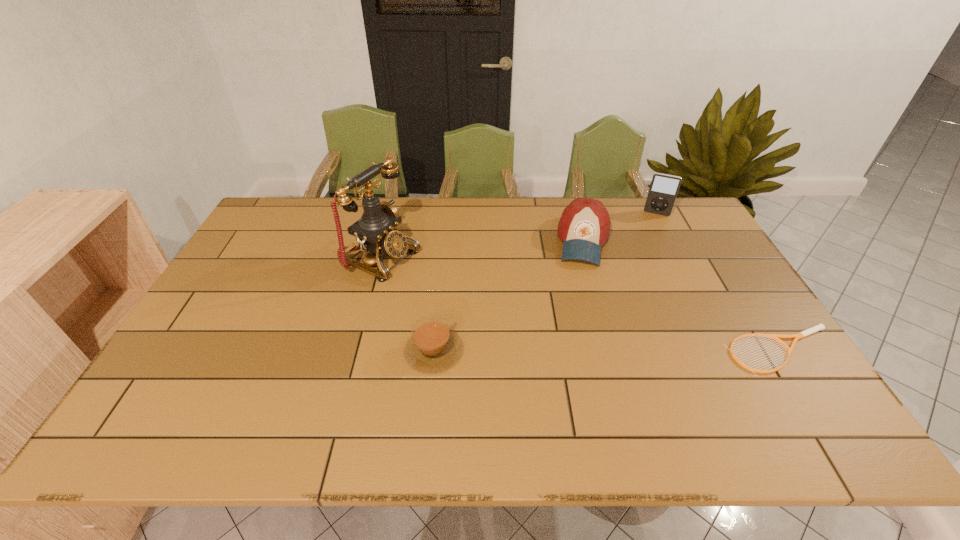
I want to click on cappuccino, so click(432, 346).

At what (x,y) coordinates should I click in order to perform the action: click on tennis racket. Please return your answer as a coordinate pair (x, y). The image size is (960, 540). Looking at the image, I should click on (819, 327).

Image resolution: width=960 pixels, height=540 pixels. I want to click on the third shortest object, so click(x=584, y=226).

I want to click on the third object from right to left, so click(584, 226).

The width and height of the screenshot is (960, 540). In order to click on the fourth shortest object in this screenshot , I will do `click(664, 188)`.

Where is `the tallest object`? This screenshot has height=540, width=960. the tallest object is located at coordinates (376, 231).

This screenshot has width=960, height=540. Identify the location of vacant area located 0.050m on the front of the cappuccino. (429, 394).

The width and height of the screenshot is (960, 540). I want to click on free point located 0.070m on the left of the tennis racket, so click(x=698, y=351).

Locate an element on the screen. The image size is (960, 540). vacant space situated 0.360m on the front-facing side of the third object from left to right is located at coordinates (578, 360).

Locate an element on the screen. blank space located 0.230m on the front-facing side of the third object from left to right is located at coordinates (581, 322).